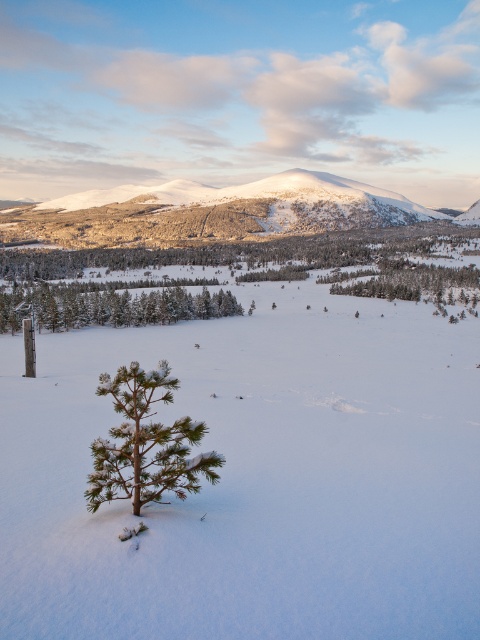
Question: Is green matte pine tree at center above green matte tree at lower left?

Choices:
 (A) no
 (B) yes

Answer: (A)

Question: Can you confirm if green matte pine tree at center is positioned to the left of green matte tree at lower left?

Choices:
 (A) no
 (B) yes

Answer: (A)

Question: Which object appears closest to the camera in this image?

Choices:
 (A) green matte pine tree at center
 (B) green matte tree at lower left

Answer: (A)

Question: Among these points, which one is farthest from the camera?

Choices:
 (A) (4, 298)
 (B) (166, 481)

Answer: (A)

Question: Does green matte pine tree at center have a lesser width compared to green matte tree at lower left?

Choices:
 (A) yes
 (B) no

Answer: (A)

Question: Which of the following is the closest to the observer?

Choices:
 (A) (139, 296)
 (B) (142, 433)

Answer: (B)